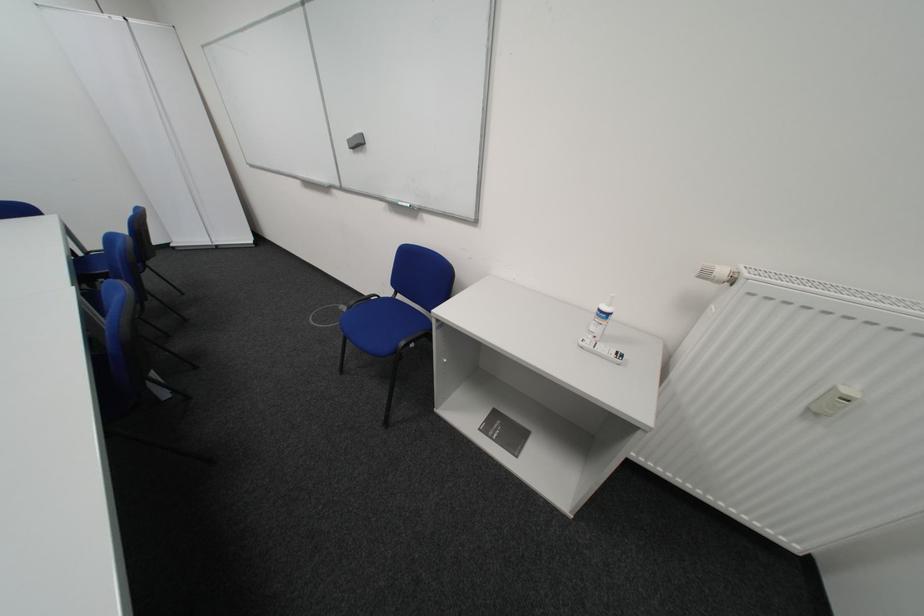
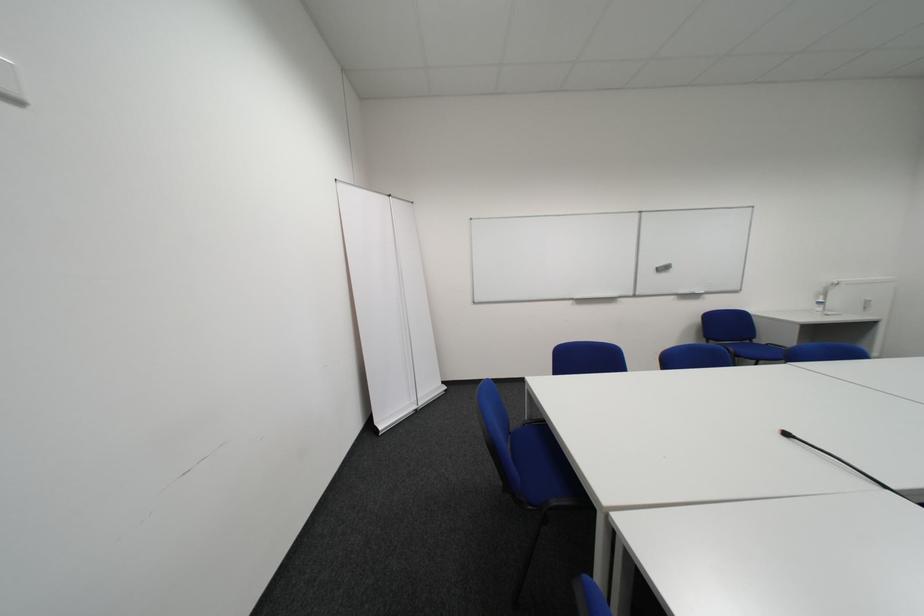
Locate, in the second image, the point that corresponds to point 361,143 in the first image.

(669, 270)